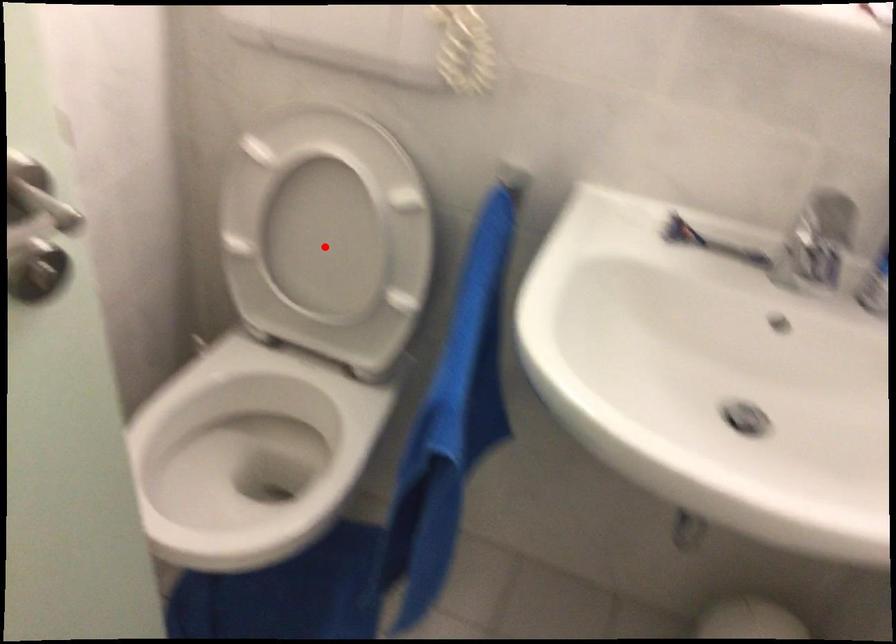
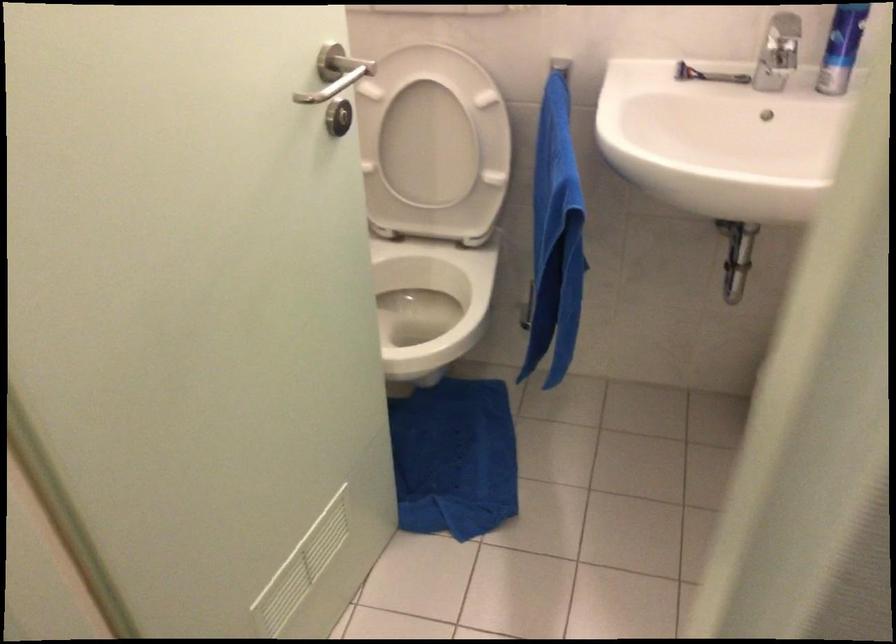
Question: A red point is marked in image1. In image2, is the corresponding 3D point closer to the camera or farther? Reply with the corresponding letter.

Choices:
 (A) The corresponding 3D point is closer.
 (B) The corresponding 3D point is farther.

Answer: (B)